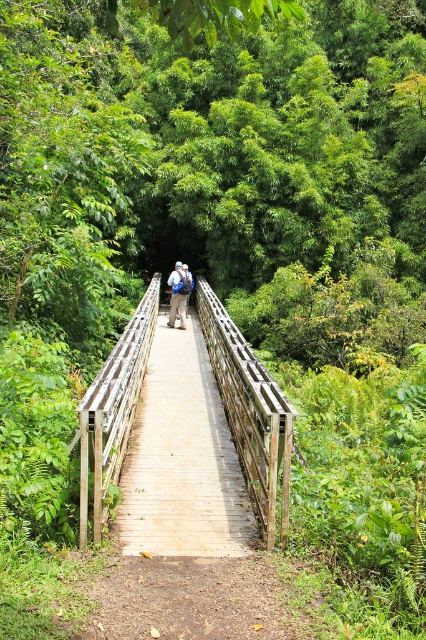
You are standing on the wooden bridge at center and want to place your blue fabric backpack at center somewhere safe. Based on their positions, where should you place it?

The wooden bridge at center is below the blue fabric backpack at center, so you should place the blue fabric backpack at center on the bridge to keep it safe from the ground.

You are hiking through the forest and see the wooden bridge at center and the blue fabric backpack at center. Which object is located to the left of the other?

The wooden bridge at center is positioned on the left side of blue fabric backpack at center, so the wooden bridge at center is to the left of the blue fabric backpack at center.

You are standing at the entrance of the forest and see the wooden bridge at center. If you want to reach the bridge, which direction should you walk towards?

The wooden bridge at center is located at point 0.644 on the x axis and 0.587 on the y axis, so you should walk towards the center of the image to reach it.